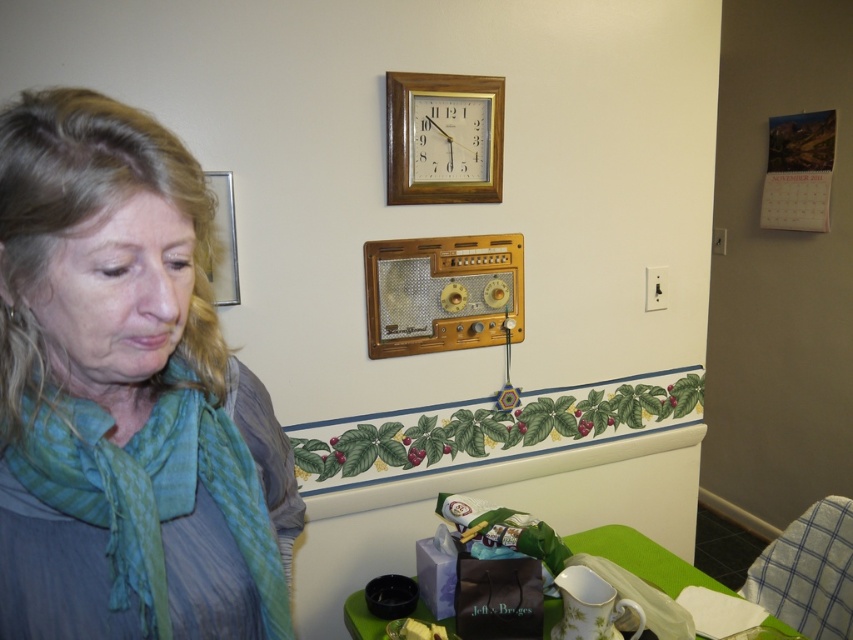
Question: Based on their relative distances, which object is nearer to the teal silk scarf at left?

Choices:
 (A) matte purple paper bag at lower center
 (B) gold-framed clock at upper center
 (C) metallic silver picture frame at upper left

Answer: (C)

Question: Which object appears closest to the camera in this image?

Choices:
 (A) gold-framed clock at upper center
 (B) teal silk scarf at left
 (C) metallic silver picture frame at upper left

Answer: (B)

Question: Can you confirm if teal silk scarf at left is wider than matte purple paper bag at lower center?

Choices:
 (A) yes
 (B) no

Answer: (B)

Question: Among these points, which one is nearest to the camera?

Choices:
 (A) (225, 195)
 (B) (277, 595)

Answer: (B)

Question: Does teal silk scarf at left have a larger size compared to gold-framed clock at upper center?

Choices:
 (A) no
 (B) yes

Answer: (B)

Question: Does matte purple paper bag at lower center have a greater width compared to metallic silver picture frame at upper left?

Choices:
 (A) yes
 (B) no

Answer: (A)